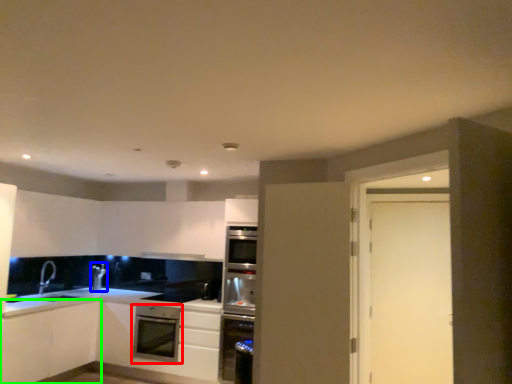
Question: Which object is the farthest from kitchen appliance (highlighted by a red box)? Choose among these: appliance (highlighted by a blue box) or cabinetry (highlighted by a green box).

Choices:
 (A) appliance
 (B) cabinetry

Answer: (A)